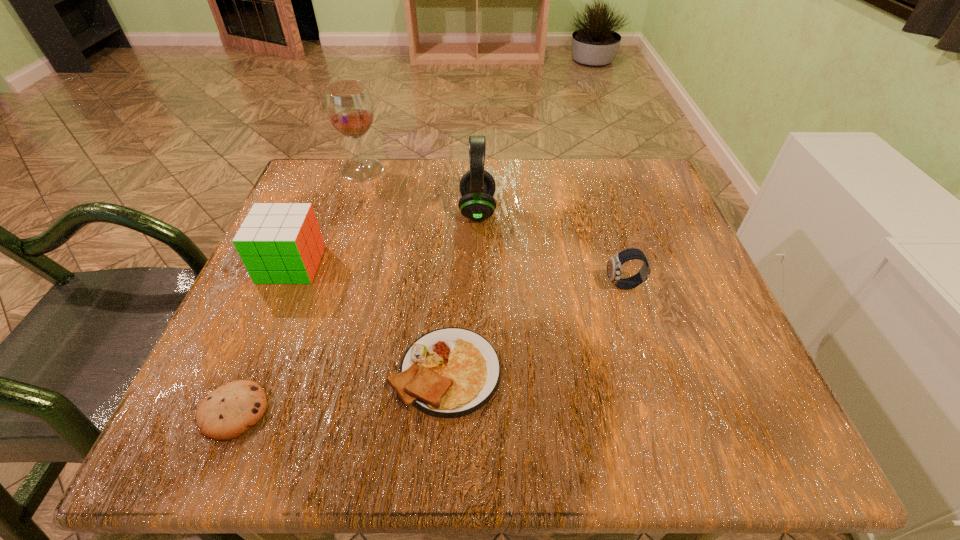
This screenshot has width=960, height=540. I want to click on cookie positioned at the near edge, so click(229, 411).

This screenshot has height=540, width=960. In order to click on wineglass present at the left edge in this screenshot , I will do `click(349, 107)`.

Where is `cube present at the left edge`? Image resolution: width=960 pixels, height=540 pixels. cube present at the left edge is located at coordinates (279, 243).

Locate an element on the screen. Image resolution: width=960 pixels, height=540 pixels. cookie that is at the left edge is located at coordinates (229, 411).

At what (x,y) coordinates should I click in order to perform the action: click on object that is positioned at the right edge. Please return your answer as a coordinate pair (x, y). Looking at the image, I should click on (614, 264).

The image size is (960, 540). In order to click on object that is at the far left corner in this screenshot , I will do coord(349,107).

At what (x,y) coordinates should I click in order to perform the action: click on object that is at the near left corner. Please return your answer as a coordinate pair (x, y). Image resolution: width=960 pixels, height=540 pixels. Looking at the image, I should click on (229, 411).

Locate an element on the screen. The height and width of the screenshot is (540, 960). free space at the far edge of the desktop is located at coordinates tap(571, 160).

The image size is (960, 540). I want to click on free region at the near edge of the desktop, so click(x=338, y=450).

Find the location of `vacant space at the left edge of the desktop`. vacant space at the left edge of the desktop is located at coordinates (338, 246).